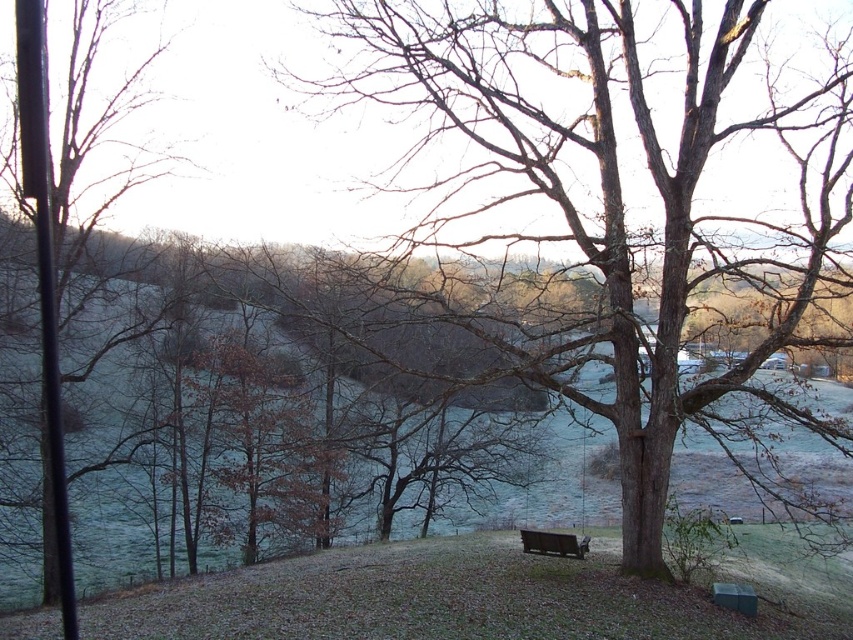
Question: Is brown rough textured tree at center wider than brown wooden bench at lower center?

Choices:
 (A) yes
 (B) no

Answer: (B)

Question: Based on their relative distances, which object is farther from the brown wooden bench at lower center?

Choices:
 (A) bare branches at left
 (B) brown rough textured tree at center

Answer: (A)

Question: Can you confirm if brown rough textured tree at center is positioned above bare branches at left?

Choices:
 (A) no
 (B) yes

Answer: (B)

Question: Which is farther from the brown wooden bench at lower center?

Choices:
 (A) brown rough textured tree at center
 (B) bare branches at left

Answer: (B)

Question: Is brown rough textured tree at center behind brown wooden bench at lower center?

Choices:
 (A) yes
 (B) no

Answer: (B)

Question: Which object appears closest to the camera in this image?

Choices:
 (A) brown wooden bench at lower center
 (B) bare branches at left

Answer: (B)